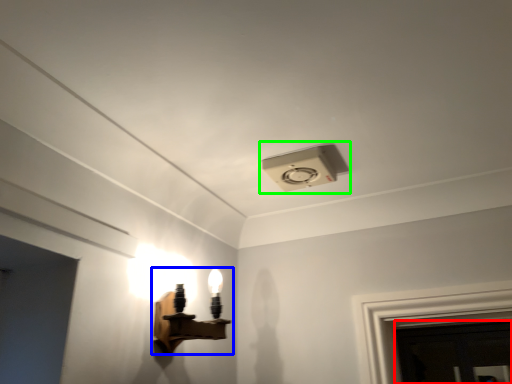
Question: Considering the real-world distances, which object is closest to door (highlighted by a red box)? lamp (highlighted by a blue box) or lamp (highlighted by a green box).

Choices:
 (A) lamp
 (B) lamp

Answer: (A)